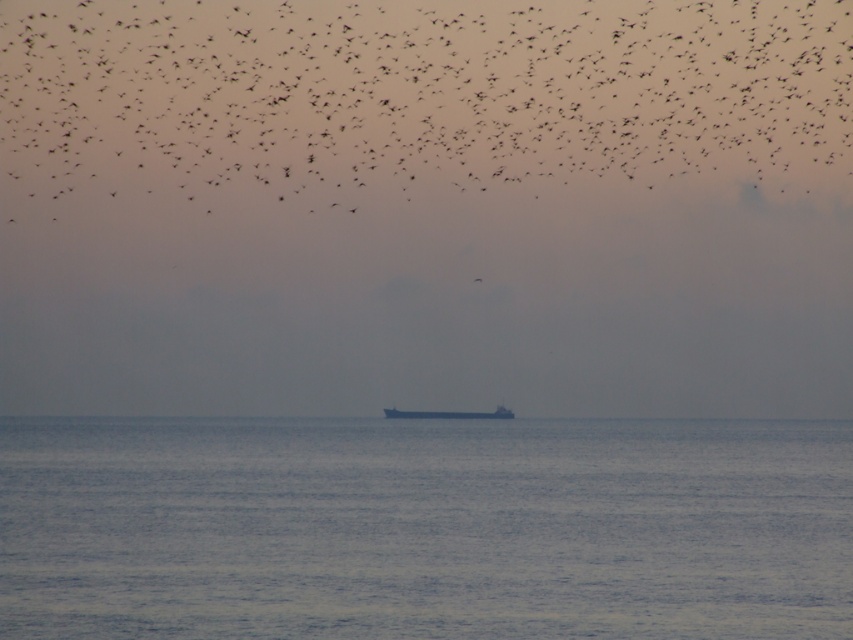
Does point (51, 492) come in front of point (476, 282)?

Yes.

Does blue matte water at center appear over black matte bird at upper center?

No, blue matte water at center is not above black matte bird at upper center.

Which is behind, point (206, 554) or point (473, 280)?

Point (473, 280)

Identify the location of blue matte water at center. The width and height of the screenshot is (853, 640). (424, 529).

Is point (482, 60) positioned after point (390, 413)?

Yes, point (482, 60) is farther from viewer.

This screenshot has width=853, height=640. Find the location of `black matte birds at upper center`. black matte birds at upper center is located at coordinates (422, 93).

Based on the photo, does blue matte water at center come in front of black matte birds at upper center?

Yes.

Between blue matte water at center and black matte birds at upper center, which one is positioned lower?

Positioned lower is blue matte water at center.

Does point (669, 568) come in front of point (590, 177)?

That is True.

The image size is (853, 640). What are the coordinates of `blue matte water at center` in the screenshot? It's located at (424, 529).